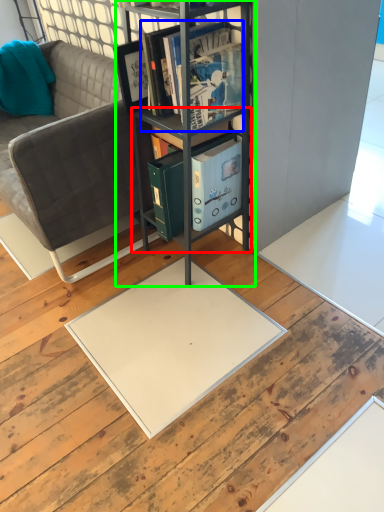
Question: Which object is the farthest from cabinet (highlighted by a red box)? Choose among these: book (highlighted by a blue box) or shelf (highlighted by a green box).

Choices:
 (A) book
 (B) shelf

Answer: (A)